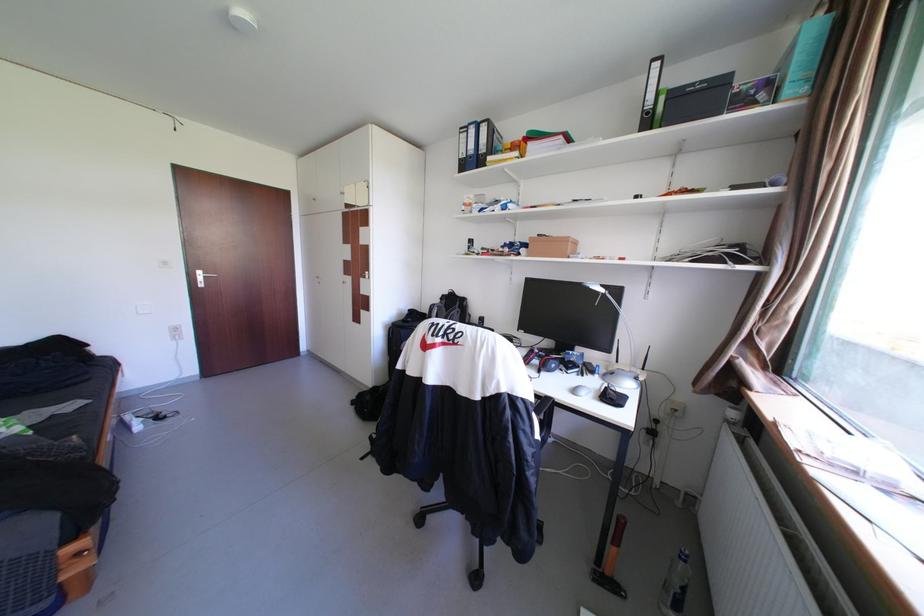
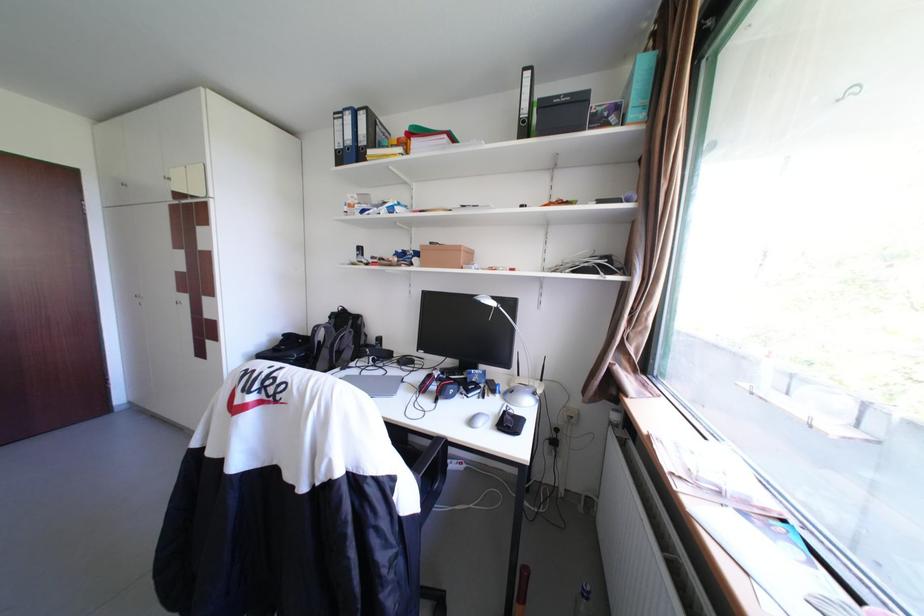
Question: The images are taken continuously from a first-person perspective. In which direction is your viewpoint rotating?

Choices:
 (A) Left
 (B) Right
 (C) Up
 (D) Down

Answer: (B)